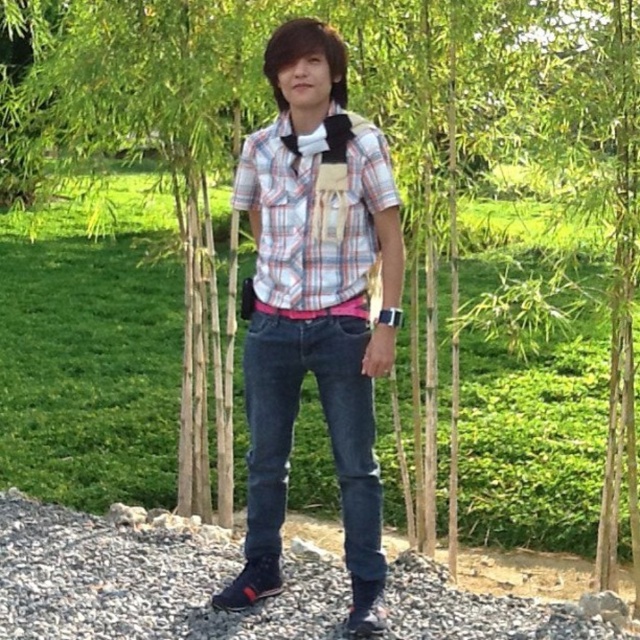
How distant is plaid cotton shirt at center from plaid shirt at center?

plaid cotton shirt at center and plaid shirt at center are 12.41 centimeters apart.

Can you confirm if plaid cotton shirt at center is positioned below plaid shirt at center?

Indeed, plaid cotton shirt at center is positioned under plaid shirt at center.

Does point (284, 445) come closer to viewer compared to point (259, 291)?

That is False.

At what (x,y) coordinates should I click in order to perform the action: click on plaid cotton shirt at center. Please return your answer as a coordinate pair (x, y). Looking at the image, I should click on (316, 305).

Does plaid cotton shirt at center appear on the left side of gray gravel at lower center?

Incorrect, plaid cotton shirt at center is not on the left side of gray gravel at lower center.

Which is more to the left, plaid cotton shirt at center or gray gravel at lower center?

From the viewer's perspective, gray gravel at lower center appears more on the left side.

Does point (260, 484) come farther from viewer compared to point (26, 620)?

Yes, point (260, 484) is farther from viewer.

Where is `plaid cotton shirt at center`? This screenshot has width=640, height=640. plaid cotton shirt at center is located at coordinates (316, 305).

Between plaid cotton shirt at center and dark blue denim jeans at center, which one is positioned lower?

dark blue denim jeans at center is below.

Which is above, plaid cotton shirt at center or dark blue denim jeans at center?

plaid cotton shirt at center is higher up.

Image resolution: width=640 pixels, height=640 pixels. Identify the location of plaid cotton shirt at center. (316, 305).